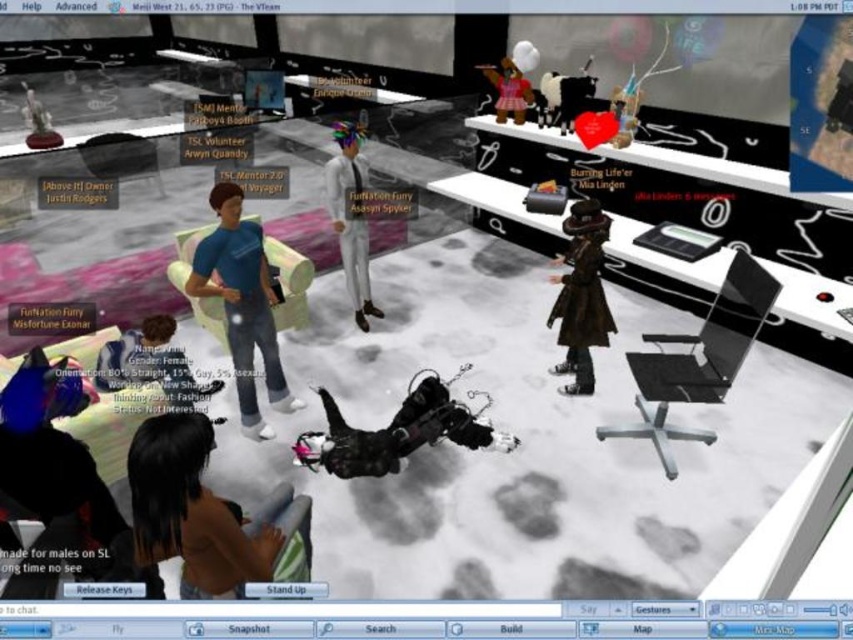
You are an avatar in the room and want to see the shiny blue hair at lower left and the matte black outfit at lower left. Which one is taller?

The shiny blue hair at lower left is much taller than the matte black outfit at lower left.

You are an avatar in this room and want to see the shiny blue hair at lower left and the black matte dog at center. Which one is closer to you?

The shiny blue hair at lower left is closer to you because it is in front of the black matte dog at center.

You are navigating a virtual room and need to locate the shiny blue hair at lower left. Based on the coordinates provided in the scene description, can you determine its position relative to the center of the room?

The shiny blue hair at lower left is located at coordinates point (57,474), which places it near the lower left area of the room, closer to the edge rather than the center.